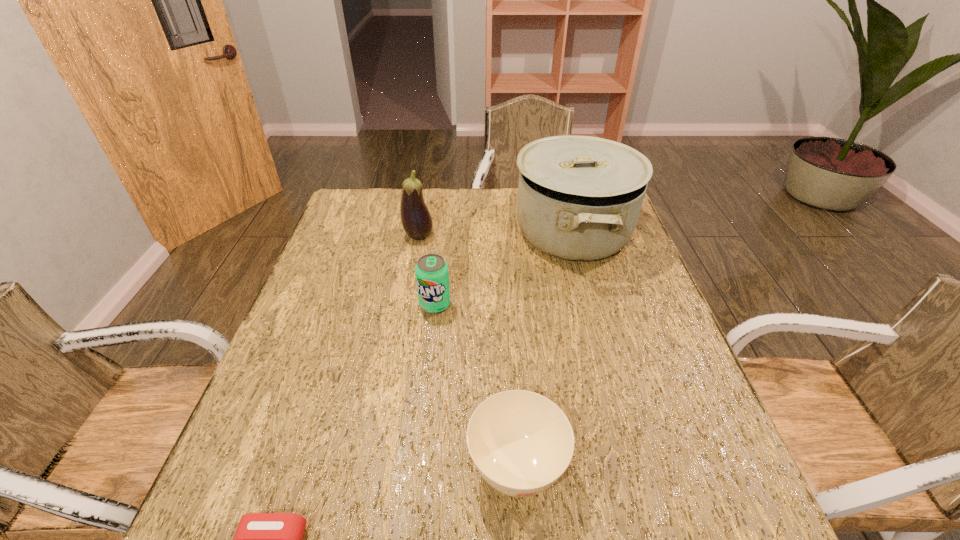
Where is `saucepan`? This screenshot has width=960, height=540. saucepan is located at coordinates (579, 198).

Locate an element on the screen. eggplant is located at coordinates (416, 220).

The height and width of the screenshot is (540, 960). Identify the location of the third farthest object. (432, 274).

This screenshot has width=960, height=540. In order to click on pop soda in this screenshot , I will do `click(432, 274)`.

The height and width of the screenshot is (540, 960). I want to click on sugar bowl, so click(521, 442).

Find the location of a particular element. Image resolution: width=960 pixels, height=540 pixels. the second shortest object is located at coordinates (521, 442).

Identify the location of blank space located on the left of the saucepan. This screenshot has width=960, height=540. (477, 232).

Find the location of a particular element. This screenshot has height=540, width=960. free region located 0.330m on the right of the eggplant is located at coordinates [541, 236].

Image resolution: width=960 pixels, height=540 pixels. I want to click on free space located on the front-facing side of the third tallest object, so click(x=432, y=334).

Where is `vacant space located 0.150m on the right of the fourth farthest object`? This screenshot has width=960, height=540. vacant space located 0.150m on the right of the fourth farthest object is located at coordinates click(648, 467).